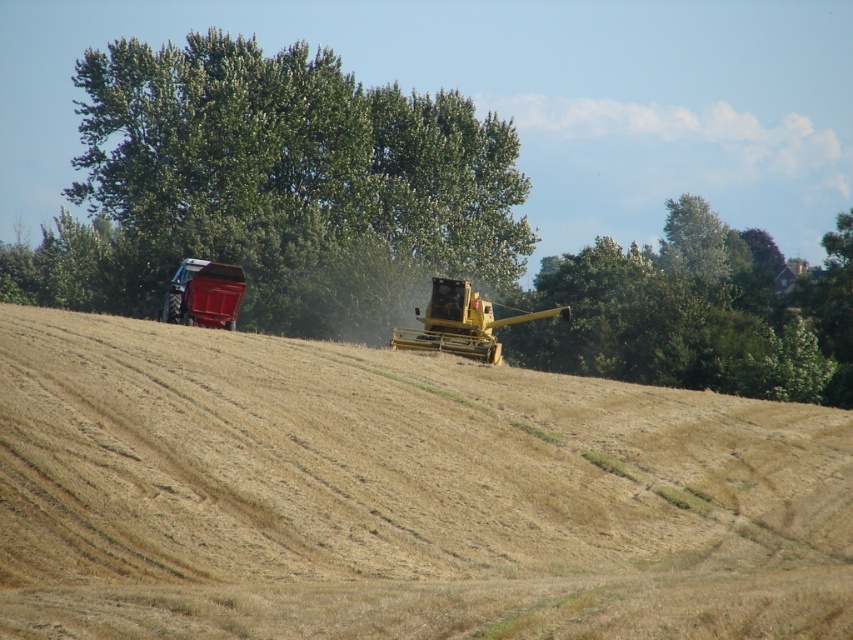
You are a farmer who needs to transport crops from the yellow metallic combine at center to the metallic red tractor at left. Considering their sizes, which one can accommodate more crops in terms of width?

The yellow metallic combine at center has a larger width than the metallic red tractor at left, so it can accommodate more crops in terms of width.

Looking at this image, you are a farmer who needs to move the yellow metallic combine at center to the storage shed located at the top of the slope. Considering the dry straw field at center is below the combine, will the combine have to move uphill or downhill to reach the shed?

The dry straw field at center is below the yellow metallic combine at center, so to reach the storage shed at the top of the slope, the combine must move uphill away from the dry straw field at center.

You are a farmer checking the field conditions. You notice the dry straw field at center and the yellow metallic combine at center. Which object has a greater height?

The dry straw field at center is taller than the yellow metallic combine at center.